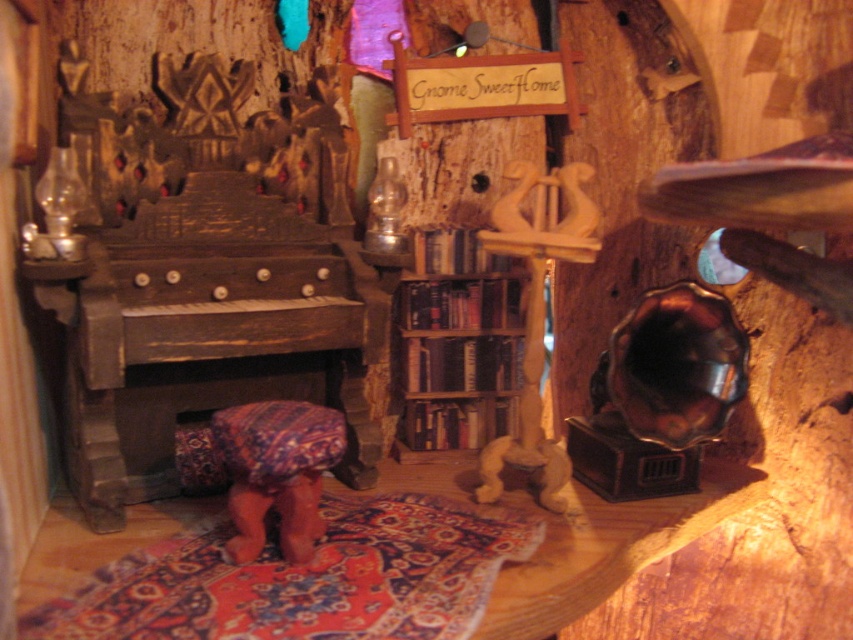
You are a small creature entering this cozy room and need to sit down. You see the wooden bookshelf at center and the patterned fabric stool at center. Which object can you sit on?

The patterned fabric stool at center is the object you can sit on, as the wooden bookshelf at center is positioned above it and likely not designed for sitting.

You are a guest in this cozy room and want to sit on the patterned fabric stool at center. To reach it, you must first move past the wooden bookshelf at center. Is the stool behind the bookshelf, making it necessary to go around the bookshelf to access it?

The patterned fabric stool at center is behind the wooden bookshelf at center, so you will need to go around the bookshelf to reach it.

You are a small creature entering this cozy room and need to sit down. There is a wooden bookshelf at center and a patterned fabric stool at center. Which object can you sit on?

The patterned fabric stool at center is the object you can sit on, as the wooden bookshelf at center is bigger but likely not designed for sitting.